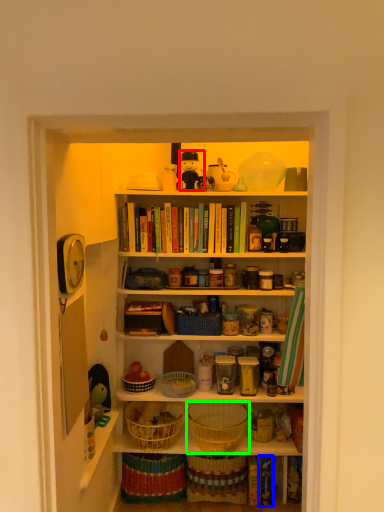
Question: Estimate the real-world distances between objects in this image. Which object is farther from toy (highlighted by a red box), book (highlighted by a blue box) or basket (highlighted by a green box)?

Choices:
 (A) book
 (B) basket

Answer: (A)